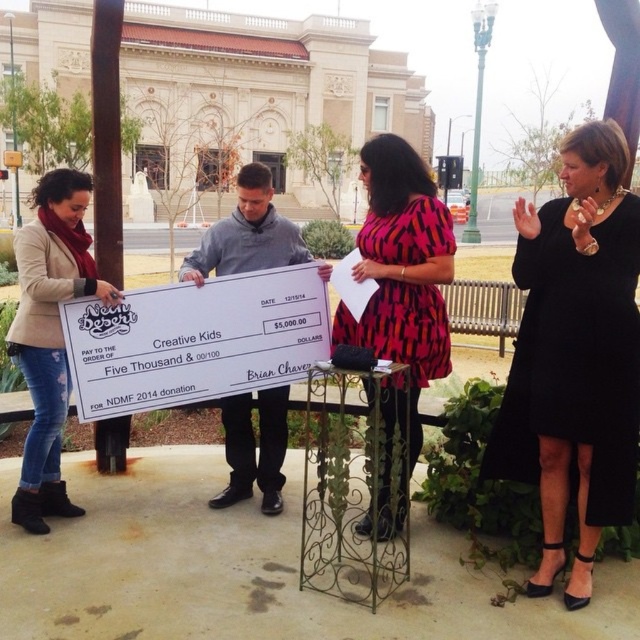
You are a photographer at the event and need to frame a photo that includes both the black satin dress at center and the gray fabric shirt at center. Which of the two should you focus on first if you want to ensure the smaller object is in sharp focus?

The black satin dress at center is smaller than the gray fabric shirt at center, so you should focus on the black satin dress at center first to ensure it is in sharp focus.

You are a photographer at the event. You need to capture a photo where the pink printed dress at center is visible without being blocked by the gray fabric shirt at center. Based on the scene description, is this possible?

Yes, the pink printed dress at center is above the gray fabric shirt at center, so it won not be blocked.